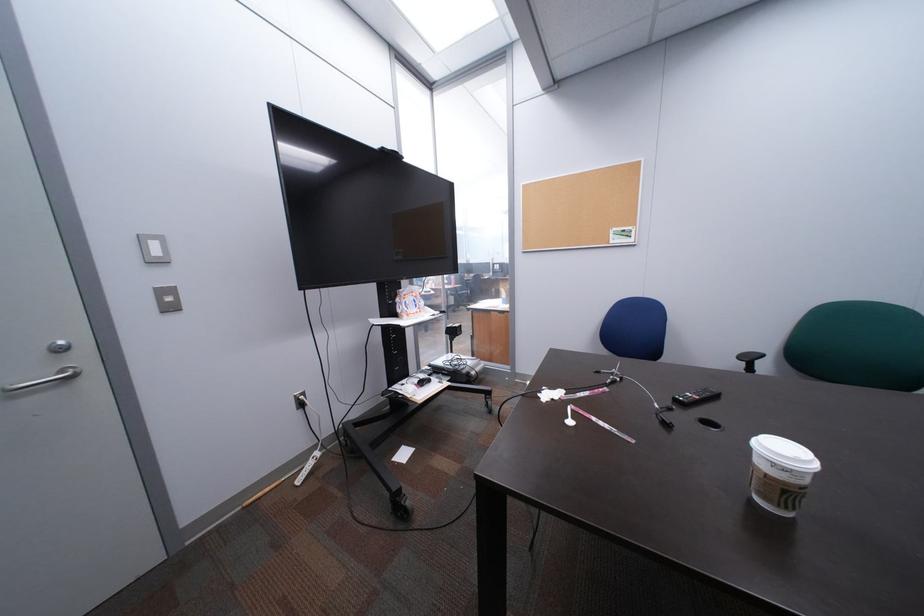
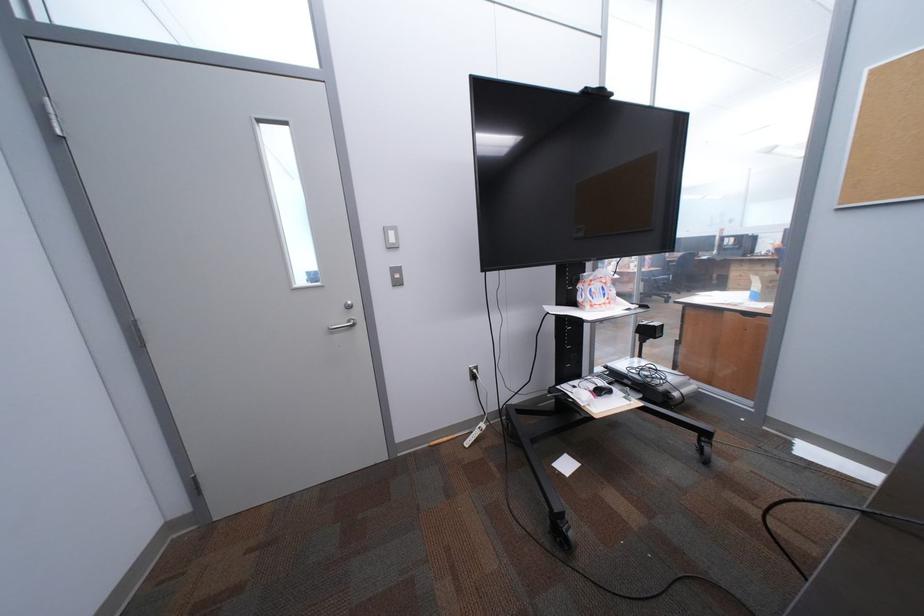
Question: Based on the continuous images, in which direction is the camera rotating? Reply with the corresponding letter.

Choices:
 (A) Left
 (B) Right
 (C) Up
 (D) Down

Answer: (A)